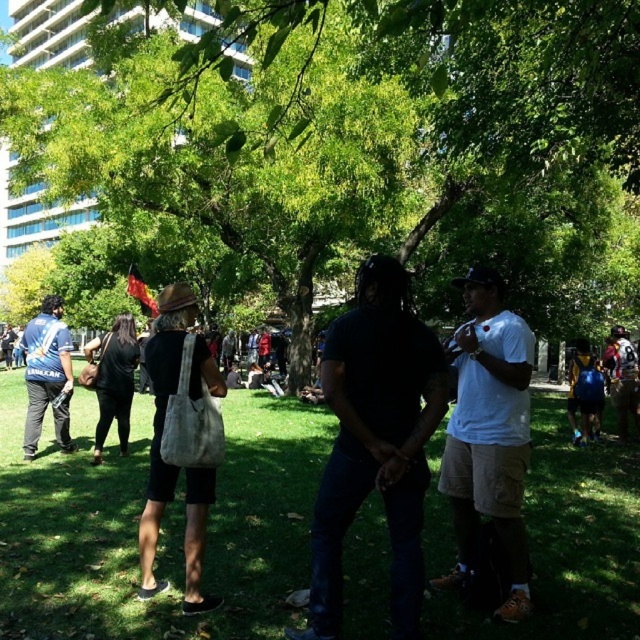
Is green grass at center thinner than blue backpack at right?

Incorrect, green grass at center's width is not less than blue backpack at right's.

Can you confirm if green grass at center is smaller than blue backpack at right?

Actually, green grass at center might be larger than blue backpack at right.

Does point (611, 525) lie in front of point (582, 362)?

Yes, it is in front of point (582, 362).

The width and height of the screenshot is (640, 640). I want to click on green grass at center, so click(x=161, y=524).

Which is more to the left, green leafy tree at center or blue backpack at right?

From the viewer's perspective, green leafy tree at center appears more on the left side.

Does green leafy tree at center appear on the left side of blue backpack at right?

Indeed, green leafy tree at center is positioned on the left side of blue backpack at right.

This screenshot has height=640, width=640. I want to click on green leafy tree at center, so pyautogui.click(x=353, y=147).

Is white cotton shirt at center smaller than matte blue shirt at left?

Correct, white cotton shirt at center occupies less space than matte blue shirt at left.

Where is `white cotton shirt at center`? The height and width of the screenshot is (640, 640). white cotton shirt at center is located at coordinates (488, 435).

The width and height of the screenshot is (640, 640). What do you see at coordinates (488, 435) in the screenshot?
I see `white cotton shirt at center` at bounding box center [488, 435].

Locate an element on the screen. This screenshot has height=640, width=640. white cotton shirt at center is located at coordinates (488, 435).